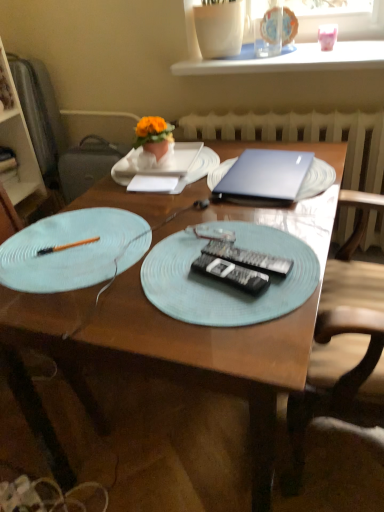
This screenshot has width=384, height=512. I want to click on unoccupied space behind black plastic remote control at center, marked as the 1th remote control in a bottom-to-top arrangement, so click(x=221, y=234).